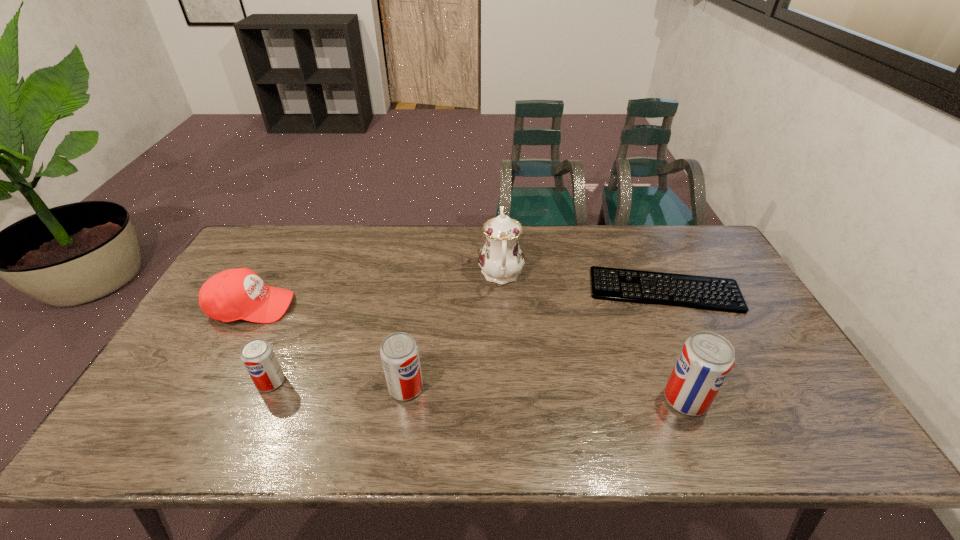
Where is `free location at the far left corner of the desktop`? Image resolution: width=960 pixels, height=540 pixels. free location at the far left corner of the desktop is located at coordinates (269, 237).

You are a GUI agent. You are given a task and a screenshot of the screen. Output one action in this format:
    pyautogui.click(x=<x>, y=<y>)
    Task: Click on the vacant space at the far right corner of the desktop
    
    Given the screenshot: What is the action you would take?
    pyautogui.click(x=708, y=246)

Where is `empty location between the computer keyboard and the baseball cap`? Image resolution: width=960 pixels, height=540 pixels. empty location between the computer keyboard and the baseball cap is located at coordinates (458, 298).

I want to click on empty location between the baseball cap and the tallest soda, so click(x=468, y=353).

Locate an element on the screen. The height and width of the screenshot is (540, 960). vacant space that's between the tallest soda and the leftmost soda is located at coordinates (478, 390).

Identify the location of free point between the tallest soda and the third object from right to left. This screenshot has width=960, height=540. (593, 336).

Find the location of a particular element. The height and width of the screenshot is (540, 960). free space between the shortest object and the shortest soda is located at coordinates (468, 336).

Identify the location of free area in between the chinaware and the second tallest soda. (453, 330).

Where is `vacant region between the third object from right to left and the baseball cap`? This screenshot has width=960, height=540. vacant region between the third object from right to left and the baseball cap is located at coordinates (376, 290).

The width and height of the screenshot is (960, 540). I want to click on free spot between the third tallest object and the leftmost soda, so click(338, 384).